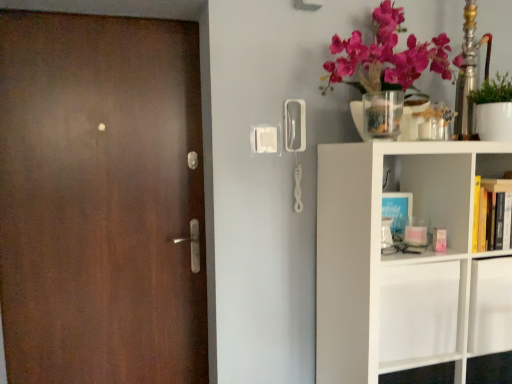
Question: Does green matte plant at upper right appear on the right side of clear glass vase at upper right?

Choices:
 (A) yes
 (B) no

Answer: (A)

Question: Does green matte plant at upper right have a lesser width compared to clear glass vase at upper right?

Choices:
 (A) no
 (B) yes

Answer: (A)

Question: Could you tell me if green matte plant at upper right is turned towards clear glass vase at upper right?

Choices:
 (A) no
 (B) yes

Answer: (A)

Question: From a real-world perspective, is green matte plant at upper right on top of clear glass vase at upper right?

Choices:
 (A) yes
 (B) no

Answer: (A)

Question: Does green matte plant at upper right have a smaller size compared to clear glass vase at upper right?

Choices:
 (A) yes
 (B) no

Answer: (B)

Question: Does green matte plant at upper right come behind clear glass vase at upper right?

Choices:
 (A) no
 (B) yes

Answer: (B)

Question: Is matte brown door at left a part of clear glass vase at upper right?

Choices:
 (A) no
 (B) yes

Answer: (A)

Question: Is clear glass vase at upper right bigger than matte brown door at left?

Choices:
 (A) no
 (B) yes

Answer: (A)

Question: Is matte brown door at left at the back of clear glass vase at upper right?

Choices:
 (A) yes
 (B) no

Answer: (B)

Question: Considering the relative sizes of clear glass vase at upper right and matte brown door at left in the image provided, is clear glass vase at upper right smaller than matte brown door at left?

Choices:
 (A) yes
 (B) no

Answer: (A)

Question: Is clear glass vase at upper right positioned far away from matte brown door at left?

Choices:
 (A) yes
 (B) no

Answer: (A)

Question: Does clear glass vase at upper right have a lesser height compared to matte brown door at left?

Choices:
 (A) yes
 (B) no

Answer: (A)

Question: From a real-world perspective, is white matte shelf at right physically above matte brown door at left?

Choices:
 (A) no
 (B) yes

Answer: (A)